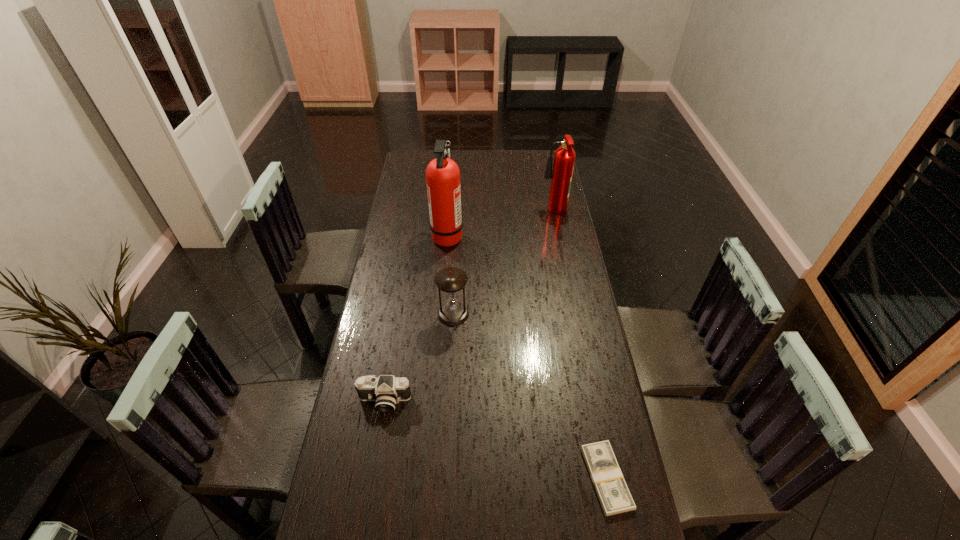
You are a GUI agent. You are given a task and a screenshot of the screen. Output one action in this format:
    pyautogui.click(x=<x>, y=<y>)
    Task: Click on the free region located on the handle side of the taller fire extinguisher
    This screenshot has width=960, height=540.
    Given the screenshot: What is the action you would take?
    pyautogui.click(x=550, y=237)

Find the location of a particular element. free space located 0.350m at the nozzle of the fourth shortest object is located at coordinates (464, 213).

Find the location of `vacant region located at the nozzle of the fourth shortest object`. vacant region located at the nozzle of the fourth shortest object is located at coordinates (501, 213).

Where is `vacant point located at the nozzle of the fourth shortest object`? This screenshot has height=540, width=960. vacant point located at the nozzle of the fourth shortest object is located at coordinates (528, 213).

Find the location of `blank area located on the right of the third tallest object`. blank area located on the right of the third tallest object is located at coordinates (519, 314).

Identify the location of vacant space situated 0.360m on the right of the leftmost object. (530, 401).

Find the location of a particular element. Image resolution: width=960 pixels, height=540 pixels. vacant region located 0.250m on the back of the dollar is located at coordinates (585, 367).

The height and width of the screenshot is (540, 960). In order to click on object that is at the left edge in this screenshot , I will do `click(387, 390)`.

The image size is (960, 540). In order to click on fire extinguisher situated at the right edge in this screenshot , I will do pyautogui.click(x=564, y=159).

The height and width of the screenshot is (540, 960). I want to click on dollar that is at the right edge, so click(613, 493).